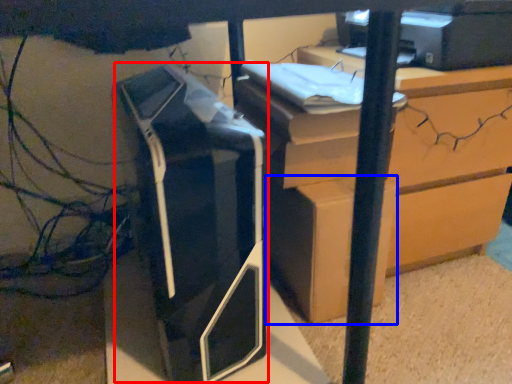
Question: Which object appears closest to the camera in this image, printer (highlighted by a red box) or cardboard box (highlighted by a blue box)?

Choices:
 (A) printer
 (B) cardboard box

Answer: (A)